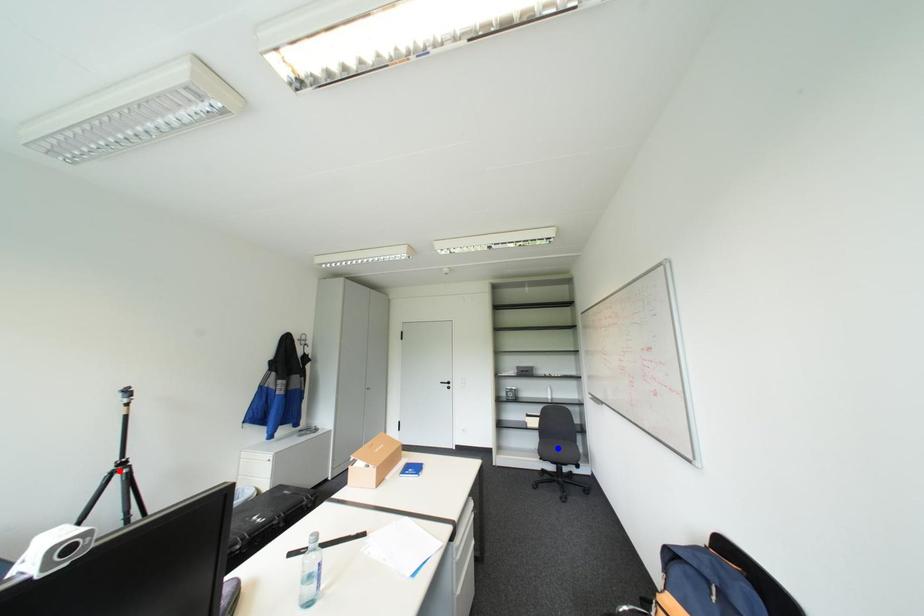
Question: Two points are marked on the image. Which point is closer to the camera?

Choices:
 (A) Blue point is closer.
 (B) Red point is closer.

Answer: (B)